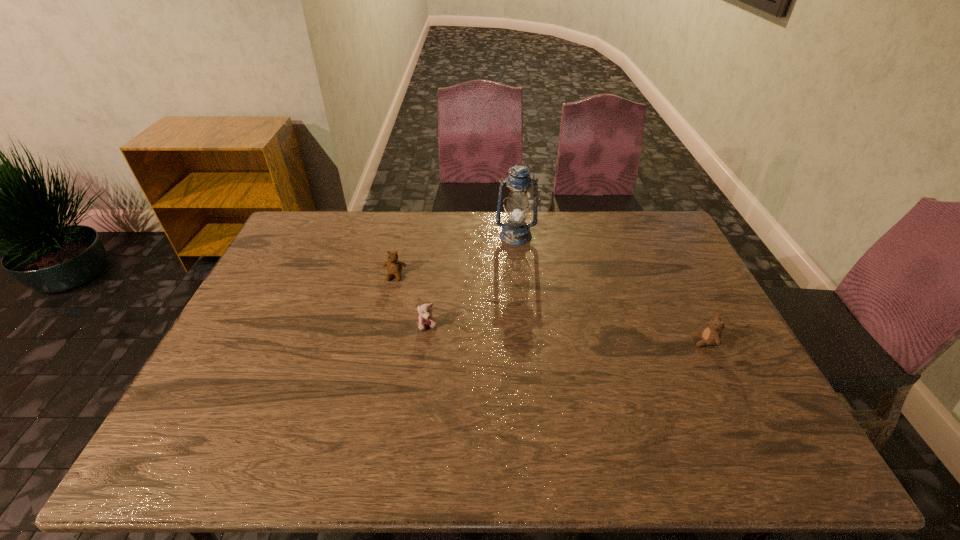
Find the location of `object identified as the second closest to the second teddy bear from left to right`. object identified as the second closest to the second teddy bear from left to right is located at coordinates (514, 232).

Locate which teddy bear ranks in proximity to the rightmost object. Please provide its 2D coordinates. Your answer should be formatted as a tuple, i.e. [(x, y)], where the tuple contains the x and y coordinates of a point satisfying the conditions above.

[(426, 318)]

You are a GUI agent. You are given a task and a screenshot of the screen. Output one action in this format:
    pyautogui.click(x=<x>, y=<y>)
    Task: Click on the teddy bear that is the closest one to the rightmost object
    This screenshot has width=960, height=540.
    Given the screenshot: What is the action you would take?
    pyautogui.click(x=426, y=318)